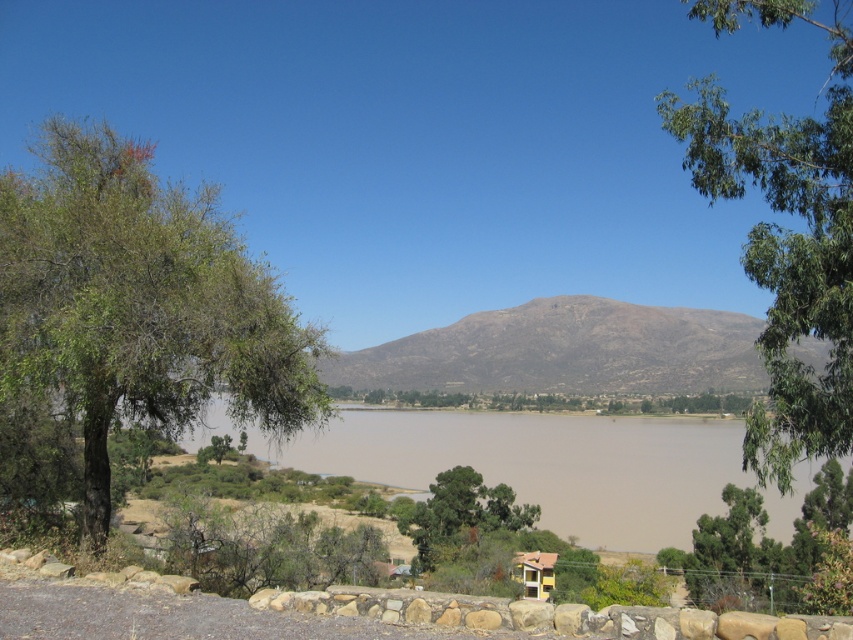
Is brown sedimentary water at center positioned before brown/drymountain at center?

Yes, brown sedimentary water at center is in front of brown/drymountain at center.

Is brown sedimentary water at center bigger than brown/drymountain at center?

No.

Between point (666, 419) and point (747, 378), which one is positioned in front?

Positioned in front is point (666, 419).

You are a GUI agent. You are given a task and a screenshot of the screen. Output one action in this format:
    pyautogui.click(x=<x>, y=<y>)
    Task: Click on the brown sedimentary water at center
    
    Given the screenshot: What is the action you would take?
    pyautogui.click(x=543, y=465)

Between point (206, 291) and point (776, 22), which one is positioned in front?

Point (776, 22)

Is the position of green leafy tree at left more distant than that of green leafy tree at upper right?

Yes, green leafy tree at left is behind green leafy tree at upper right.

Describe the element at coordinates (138, 304) in the screenshot. I see `green leafy tree at left` at that location.

Find the location of `green leafy tree at left`. green leafy tree at left is located at coordinates (138, 304).

Between green leafy tree at left and brown sedimentary water at center, which one appears on the left side from the viewer's perspective?

green leafy tree at left is more to the left.

Does point (90, 456) lie in front of point (698, 433)?

Yes, point (90, 456) is closer to viewer.

Is point (38, 138) closer to viewer compared to point (259, 456)?

That is False.

Find the location of `green leafy tree at left`. green leafy tree at left is located at coordinates (138, 304).